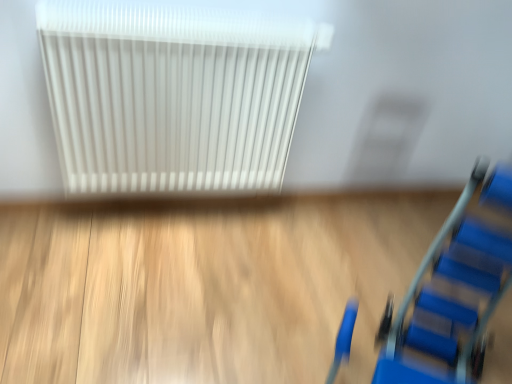
Question: Is white plastic radiator at upper center behind blue plastic ladder at lower right?

Choices:
 (A) no
 (B) yes

Answer: (B)

Question: Is white plastic radiator at upper center shorter than blue plastic ladder at lower right?

Choices:
 (A) no
 (B) yes

Answer: (B)

Question: Can you confirm if white plastic radiator at upper center is wider than blue plastic ladder at lower right?

Choices:
 (A) no
 (B) yes

Answer: (A)

Question: Does white plastic radiator at upper center have a greater height compared to blue plastic ladder at lower right?

Choices:
 (A) yes
 (B) no

Answer: (B)

Question: From a real-world perspective, is white plastic radiator at upper center over blue plastic ladder at lower right?

Choices:
 (A) yes
 (B) no

Answer: (A)

Question: Is white plastic radiator at upper center positioned with its back to blue plastic ladder at lower right?

Choices:
 (A) no
 (B) yes

Answer: (A)

Question: From the image's perspective, is blue plastic ladder at lower right on top of white plastic radiator at upper center?

Choices:
 (A) no
 (B) yes

Answer: (A)

Question: Does blue plastic ladder at lower right have a lesser width compared to white plastic radiator at upper center?

Choices:
 (A) yes
 (B) no

Answer: (B)

Question: Does blue plastic ladder at lower right touch white plastic radiator at upper center?

Choices:
 (A) yes
 (B) no

Answer: (B)

Question: Is blue plastic ladder at lower right outside white plastic radiator at upper center?

Choices:
 (A) no
 (B) yes

Answer: (B)

Question: Is blue plastic ladder at lower right wider than white plastic radiator at upper center?

Choices:
 (A) yes
 (B) no

Answer: (A)

Question: Is blue plastic ladder at lower right shorter than white plastic radiator at upper center?

Choices:
 (A) yes
 (B) no

Answer: (B)

Question: Is blue plastic ladder at lower right bigger or smaller than white plastic radiator at upper center?

Choices:
 (A) small
 (B) big

Answer: (B)